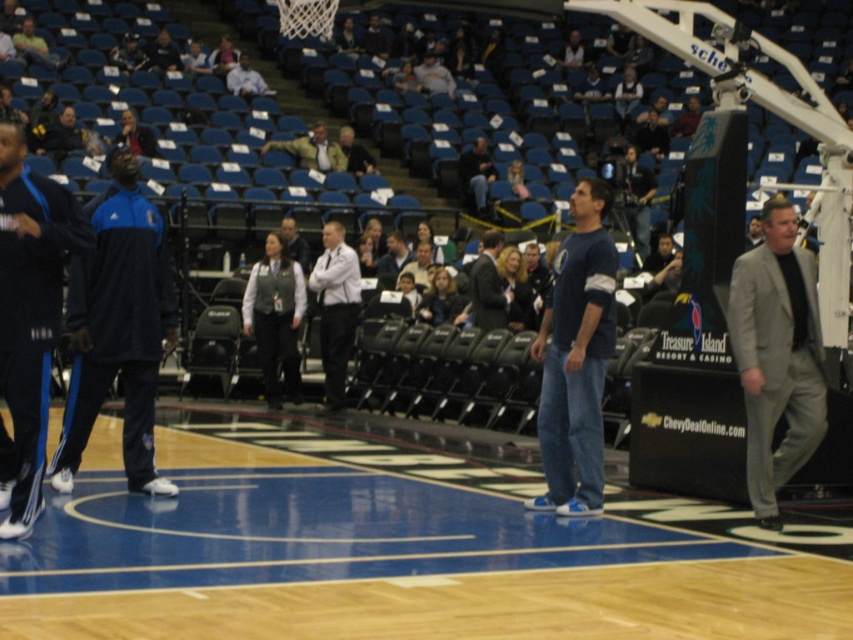
Can you confirm if blue synthetic track suit at left is shorter than white shirt at center?

No.

Does blue synthetic track suit at left appear on the right side of white shirt at center?

Incorrect, blue synthetic track suit at left is not on the right side of white shirt at center.

Is point (141, 195) positioned in front of point (343, 326)?

Yes, point (141, 195) is in front of point (343, 326).

Where is `blue synthetic track suit at left`? blue synthetic track suit at left is located at coordinates (119, 326).

This screenshot has width=853, height=640. Identify the location of gray suit at right. (776, 355).

What do you see at coordinates (776, 355) in the screenshot?
I see `gray suit at right` at bounding box center [776, 355].

This screenshot has height=640, width=853. Identify the location of gray suit at right. (776, 355).

From the picture: Can you confirm if wooden basketball court at center is wider than gray suit at right?

Answer: Yes, wooden basketball court at center is wider than gray suit at right.

Who is positioned more to the right, wooden basketball court at center or gray suit at right?

From the viewer's perspective, gray suit at right appears more on the right side.

I want to click on wooden basketball court at center, so click(x=380, y=561).